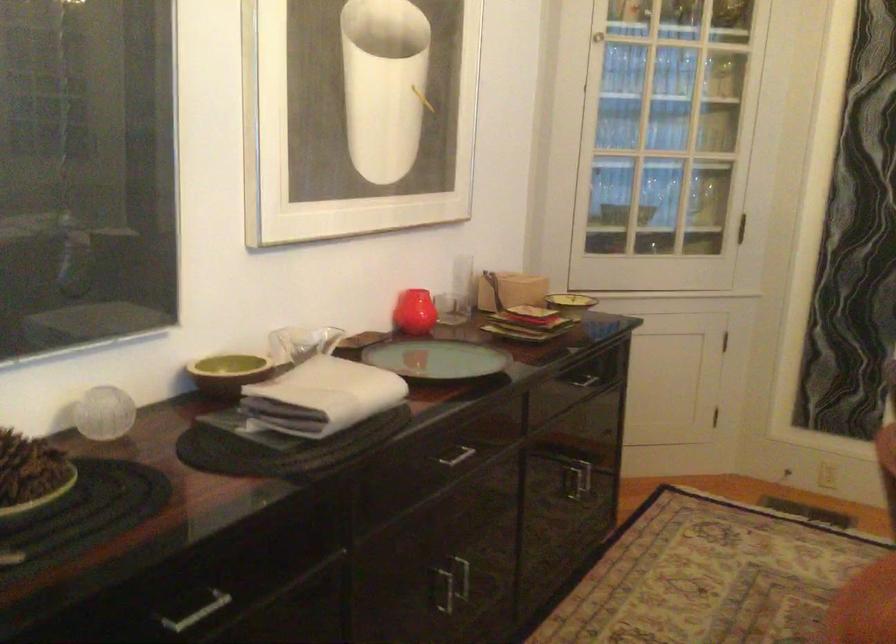
Where would you lift the textured glass sphere? Please return your answer as a coordinate pair (x, y).

(104, 413)